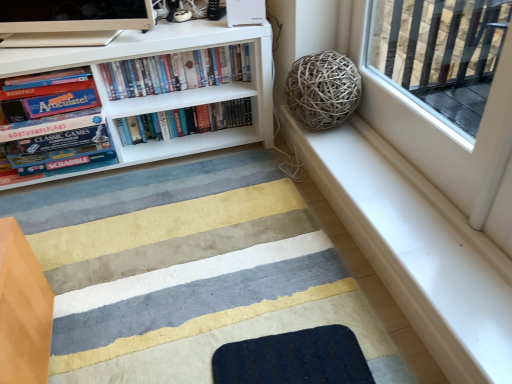
Question: Is matte board game at left, the third book in the right-to-left sequence, smaller than hardcover books at center, the second book in the right-to-left sequence?

Choices:
 (A) yes
 (B) no

Answer: (B)

Question: Considering the relative sizes of matte board game at left, arranged as the 1th book when viewed from the left, and hardcover books at center, positioned as the 2th book in left-to-right order, in the image provided, is matte board game at left, arranged as the 1th book when viewed from the left, taller than hardcover books at center, positioned as the 2th book in left-to-right order,?

Choices:
 (A) no
 (B) yes

Answer: (B)

Question: Can you confirm if matte board game at left, arranged as the 1th book when viewed from the left, is positioned to the right of hardcover books at center, positioned as the 2th book in left-to-right order?

Choices:
 (A) no
 (B) yes

Answer: (A)

Question: Is matte board game at left, the third book in the right-to-left sequence, facing towards hardcover books at center, the second book in the right-to-left sequence?

Choices:
 (A) no
 (B) yes

Answer: (A)

Question: Is matte board game at left, the third book in the right-to-left sequence, oriented away from hardcover books at center, the second book in the right-to-left sequence?

Choices:
 (A) yes
 (B) no

Answer: (B)

Question: Considering the positions of white smooth window sill at upper right and dark blue textured mat at lower center, which ranks as the first doormat in back-to-front order, in the image, is white smooth window sill at upper right bigger or smaller than dark blue textured mat at lower center, which ranks as the first doormat in back-to-front order,?

Choices:
 (A) big
 (B) small

Answer: (A)

Question: In terms of height, does white smooth window sill at upper right look taller or shorter compared to dark blue textured mat at lower center, which is the second doormat in front-to-back order?

Choices:
 (A) tall
 (B) short

Answer: (A)

Question: Is white smooth window sill at upper right inside the boundaries of dark blue textured mat at lower center, which is the second doormat in front-to-back order, or outside?

Choices:
 (A) outside
 (B) inside

Answer: (A)

Question: Does point (395, 223) appear closer or farther from the camera than point (280, 377)?

Choices:
 (A) closer
 (B) farther

Answer: (B)

Question: Relative to hardcover books at center, which is the third book from left to right, is hardcover books at center, the second book in the right-to-left sequence, in front or behind?

Choices:
 (A) front
 (B) behind

Answer: (A)

Question: Is point (243, 66) closer or farther from the camera than point (138, 119)?

Choices:
 (A) farther
 (B) closer

Answer: (B)

Question: From their relative heights in the image, would you say hardcover books at center, the second book in the right-to-left sequence, is taller or shorter than hardcover books at center, which is the third book from left to right?

Choices:
 (A) tall
 (B) short

Answer: (A)

Question: In terms of width, does hardcover books at center, positioned as the 2th book in left-to-right order, look wider or thinner when compared to hardcover books at center, the 1th book viewed from the right?

Choices:
 (A) wide
 (B) thin

Answer: (A)

Question: Is dark blue textured mat at lower center, which ranks as the first doormat in back-to-front order, in front of or behind white matte bookcase at upper left in the image?

Choices:
 (A) front
 (B) behind

Answer: (A)

Question: Is dark blue textured mat at lower center, which is the second doormat in front-to-back order, situated inside white matte bookcase at upper left or outside?

Choices:
 (A) outside
 (B) inside

Answer: (A)